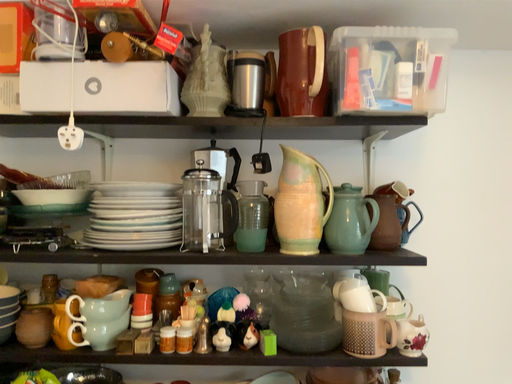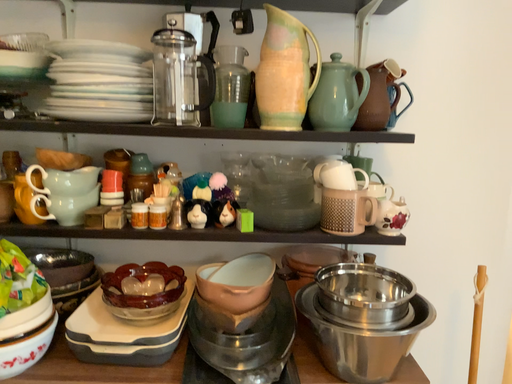
Question: Which way did the camera rotate in the video?

Choices:
 (A) rotated downward
 (B) rotated upward

Answer: (A)